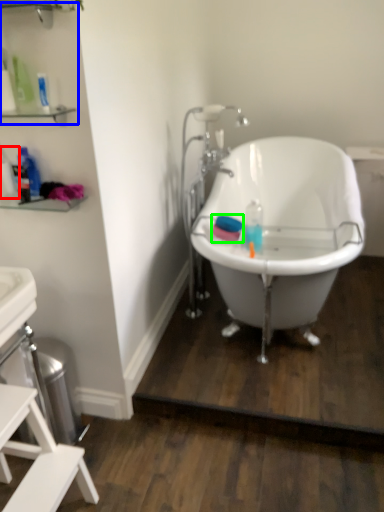
Question: Which is nearer to the bottle (highlighted by a red box)? shelf (highlighted by a blue box) or mouthwash (highlighted by a green box).

Choices:
 (A) shelf
 (B) mouthwash

Answer: (A)